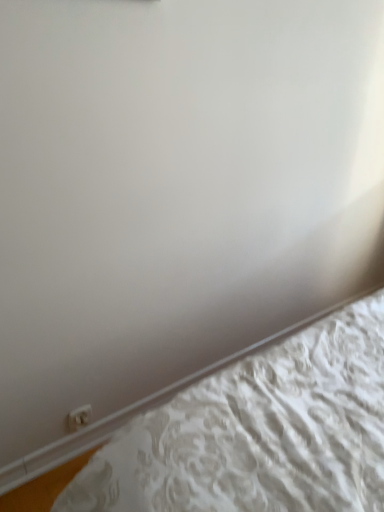
What is the approximate height of white textured mattress at lower right?

white textured mattress at lower right is 3.60 inches in height.

Measure the distance between white textured mattress at lower right and camera.

They are 31.25 inches apart.

The height and width of the screenshot is (512, 384). In order to click on white textured mattress at lower right in this screenshot , I will do `click(259, 432)`.

Describe the element at coordinates (259, 432) in the screenshot. I see `white textured mattress at lower right` at that location.

The image size is (384, 512). What do you see at coordinates (79, 417) in the screenshot?
I see `white plastic electric outlet at lower left` at bounding box center [79, 417].

Find the location of a particular element. The image size is (384, 512). white plastic electric outlet at lower left is located at coordinates (79, 417).

The height and width of the screenshot is (512, 384). In order to click on white textured mattress at lower right in this screenshot , I will do `click(259, 432)`.

Between white plastic electric outlet at lower left and white textured mattress at lower right, which one appears on the right side from the viewer's perspective?

white textured mattress at lower right is more to the right.

Considering the positions of objects white plastic electric outlet at lower left and white textured mattress at lower right in the image provided, who is behind, white plastic electric outlet at lower left or white textured mattress at lower right?

white plastic electric outlet at lower left is behind.

Is point (89, 407) closer to viewer compared to point (134, 449)?

No.

From the image's perspective, is white plastic electric outlet at lower left above or below white textured mattress at lower right?

Clearly, from the image's perspective, white plastic electric outlet at lower left is below white textured mattress at lower right.

From a real-world perspective, which object stands above the other?

From a 3D spatial view, white plastic electric outlet at lower left is above.

Does white plastic electric outlet at lower left have a lesser width compared to white textured mattress at lower right?

Yes, white plastic electric outlet at lower left is thinner than white textured mattress at lower right.

Considering the sizes of white plastic electric outlet at lower left and white textured mattress at lower right in the image, is white plastic electric outlet at lower left taller or shorter than white textured mattress at lower right?

Considering their sizes, white plastic electric outlet at lower left has more height than white textured mattress at lower right.

Who is smaller, white plastic electric outlet at lower left or white textured mattress at lower right?

Smaller between the two is white plastic electric outlet at lower left.

Based on the photo, is white plastic electric outlet at lower left located outside white textured mattress at lower right?

Yes, white plastic electric outlet at lower left is located beyond the bounds of white textured mattress at lower right.

From the picture: Is the surface of white plastic electric outlet at lower left in direct contact with white textured mattress at lower right?

white plastic electric outlet at lower left and white textured mattress at lower right are clearly separated.

Is white plastic electric outlet at lower left positioned with its back to white textured mattress at lower right?

No.

The width and height of the screenshot is (384, 512). I want to click on bed that appears above the white plastic electric outlet at lower left (from the image's perspective), so click(259, 432).

Considering the relative positions of white textured mattress at lower right and white plastic electric outlet at lower left in the image provided, is white textured mattress at lower right to the right of white plastic electric outlet at lower left from the viewer's perspective?

Indeed, white textured mattress at lower right is positioned on the right side of white plastic electric outlet at lower left.

Which is behind, white textured mattress at lower right or white plastic electric outlet at lower left?

white plastic electric outlet at lower left is more distant.

Which point is more forward, (362,425) or (86,405)?

The point (362,425) is in front.

From the image's perspective, is white textured mattress at lower right over white plastic electric outlet at lower left?

Indeed, from the image's perspective, white textured mattress at lower right is shown above white plastic electric outlet at lower left.

From a real-world perspective, is white textured mattress at lower right located beneath white plastic electric outlet at lower left?

Correct, in the physical world, white textured mattress at lower right is lower than white plastic electric outlet at lower left.

Can you confirm if white textured mattress at lower right is wider than white plastic electric outlet at lower left?

Yes.

Who is shorter, white textured mattress at lower right or white plastic electric outlet at lower left?

Standing shorter between the two is white textured mattress at lower right.

Considering the sizes of objects white textured mattress at lower right and white plastic electric outlet at lower left in the image provided, who is smaller, white textured mattress at lower right or white plastic electric outlet at lower left?

Smaller between the two is white plastic electric outlet at lower left.

Looking at this image, is white plastic electric outlet at lower left inside white textured mattress at lower right?

That's incorrect, white plastic electric outlet at lower left is not inside white textured mattress at lower right.

Is white textured mattress at lower right not close to white plastic electric outlet at lower left?

No, white textured mattress at lower right is not far from white plastic electric outlet at lower left.

Could you tell me if white textured mattress at lower right is turned towards white plastic electric outlet at lower left?

No, white textured mattress at lower right is not oriented towards white plastic electric outlet at lower left.

You are a GUI agent. You are given a task and a screenshot of the screen. Output one action in this format:
    pyautogui.click(x=<x>, y=<y>)
    Task: Click on the electric outlet above the white textured mattress at lower right (from a real-world perspective)
    
    Given the screenshot: What is the action you would take?
    pyautogui.click(x=79, y=417)

Image resolution: width=384 pixels, height=512 pixels. Find the location of `bed above the white plastic electric outlet at lower left (from the image's perspective)`. bed above the white plastic electric outlet at lower left (from the image's perspective) is located at coordinates [259, 432].

Where is `bed on the right side of white plastic electric outlet at lower left`? The width and height of the screenshot is (384, 512). bed on the right side of white plastic electric outlet at lower left is located at coordinates (259, 432).